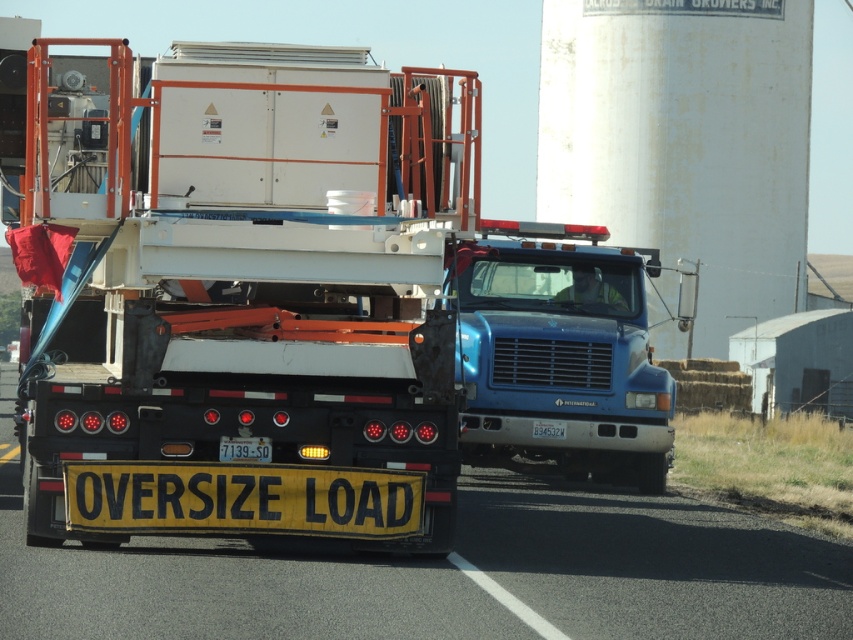
Question: Can you confirm if blue metallic truck at center is positioned below yellow plastic license plate at center?

Choices:
 (A) yes
 (B) no

Answer: (B)

Question: Which of the following is the closest to the observer?

Choices:
 (A) yellowmaterial/texturelicense plate at center
 (B) white painted concrete water tower at upper center
 (C) blue metallic truck at center
 (D) white plastic trailer at center

Answer: (D)

Question: Is white matte container at center to the right of yellow plastic license plate at center from the viewer's perspective?

Choices:
 (A) no
 (B) yes

Answer: (A)

Question: Considering the relative positions of white painted concrete water tower at upper center and blue metallic truck at center in the image provided, where is white painted concrete water tower at upper center located with respect to blue metallic truck at center?

Choices:
 (A) above
 (B) below

Answer: (A)

Question: Which object is the farthest from the white painted concrete water tower at upper center?

Choices:
 (A) blue metallic truck at center
 (B) yellowmaterial/texturelicense plate at center

Answer: (B)

Question: Which object appears closest to the camera in this image?

Choices:
 (A) yellowmaterial/texturelicense plate at center
 (B) white painted concrete water tower at upper center

Answer: (A)